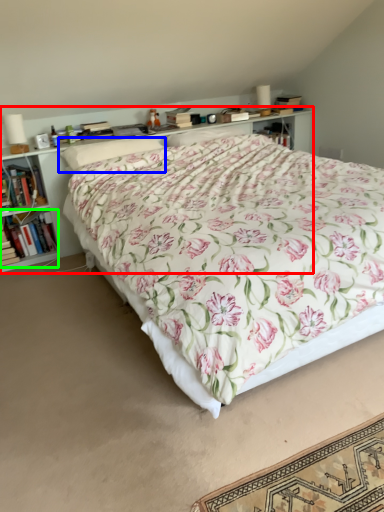
Question: Estimate the real-world distances between objects in this image. Which object is farther from shelf (highlighted by a red box), pillow (highlighted by a blue box) or book (highlighted by a green box)?

Choices:
 (A) pillow
 (B) book

Answer: (A)